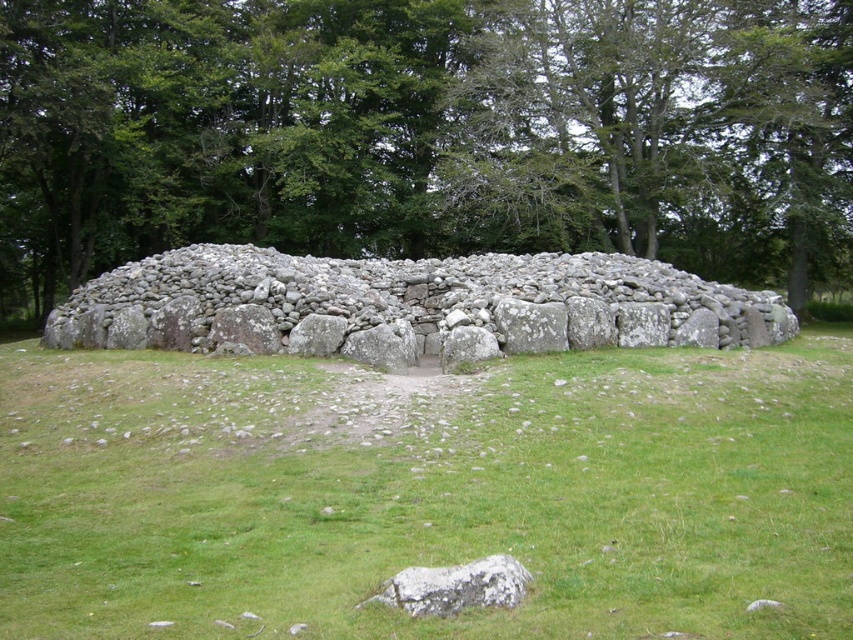
Question: Which point is closer to the camera?

Choices:
 (A) gray rough rock at lower center
 (B) green grass at center
 (C) green leafy tree at upper center
 (D) gray stone wall at center

Answer: (B)

Question: Which point appears farthest from the camera in this image?

Choices:
 (A) (466, 586)
 (B) (651, 276)
 (C) (61, 440)

Answer: (B)

Question: Can you confirm if green grass at center is positioned below green leafy tree at upper center?

Choices:
 (A) no
 (B) yes

Answer: (B)

Question: Is green leafy tree at upper center above gray rough rock at lower center?

Choices:
 (A) yes
 (B) no

Answer: (A)

Question: Is green leafy tree at upper center smaller than gray stone wall at center?

Choices:
 (A) no
 (B) yes

Answer: (A)

Question: Which point is closer to the camera?

Choices:
 (A) green leafy tree at upper center
 (B) green grass at center
 (C) gray stone wall at center

Answer: (B)